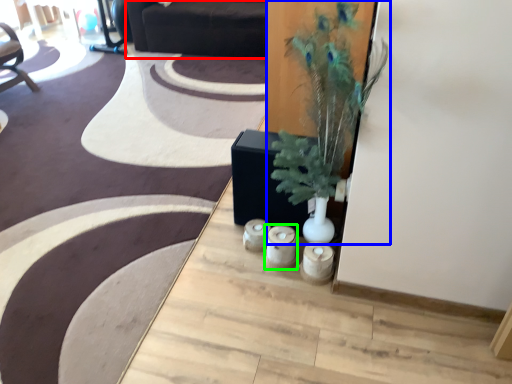
Question: Which object is the farthest from couch (highlighted by a red box)? Choose among these: houseplant (highlighted by a blue box) or candle holder (highlighted by a green box).

Choices:
 (A) houseplant
 (B) candle holder

Answer: (B)